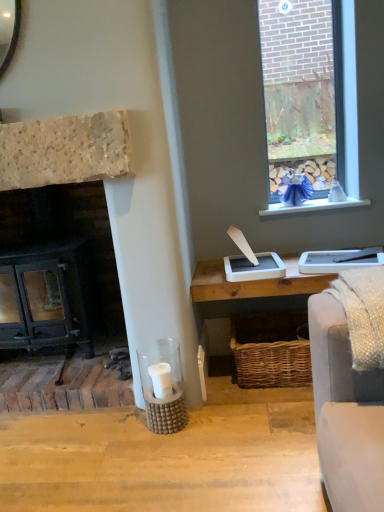
Question: Do you think white painted wood at upper right is within black cast iron fireplace at left, or outside of it?

Choices:
 (A) inside
 (B) outside

Answer: (B)

Question: Is white painted wood at upper right in front of or behind black cast iron fireplace at left in the image?

Choices:
 (A) behind
 (B) front

Answer: (A)

Question: Is point (311, 202) closer or farther from the camera than point (3, 182)?

Choices:
 (A) farther
 (B) closer

Answer: (A)

Question: Is black cast iron fireplace at left inside or outside of white painted wood at upper right?

Choices:
 (A) outside
 (B) inside

Answer: (A)

Question: Relative to white painted wood at upper right, is black cast iron fireplace at left in front or behind?

Choices:
 (A) front
 (B) behind

Answer: (A)

Question: Based on their sizes in the image, would you say black cast iron fireplace at left is bigger or smaller than white painted wood at upper right?

Choices:
 (A) small
 (B) big

Answer: (B)

Question: In the image, is black cast iron fireplace at left on the left side or the right side of white painted wood at upper right?

Choices:
 (A) right
 (B) left

Answer: (B)